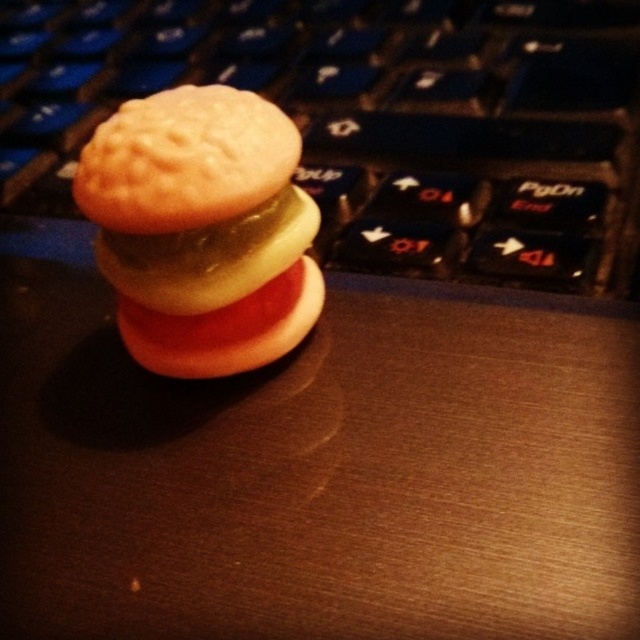
You are organizing items on your desk and need to place the black plastic keyboard at center and the matte orange biscuit at center. If you want to move the biscuit closer to you, which object should you move and in which direction?

To move the matte orange biscuit at center closer to you, you should move it towards the black plastic keyboard at center since the keyboard is already closer to you than the biscuit.

You are organizing items on your desk and need to place the black plastic keyboard at center and the matte orange biscuit at center. According to the image, which item is positioned to the left?

The matte orange biscuit at center is positioned to the left of the black plastic keyboard at center.